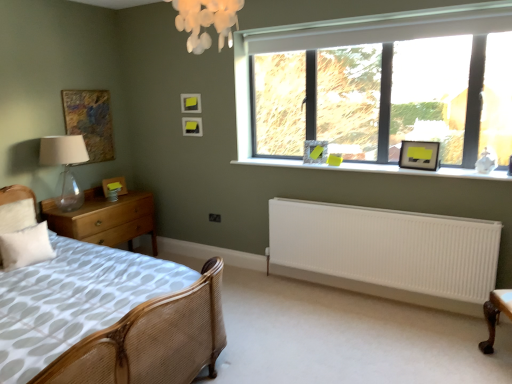
Question: Looking at the image, does white soft pillow at lower left seem bigger or smaller compared to white smooth window sill at center?

Choices:
 (A) small
 (B) big

Answer: (A)

Question: Is white soft pillow at lower left spatially inside white smooth window sill at center, or outside of it?

Choices:
 (A) inside
 (B) outside

Answer: (B)

Question: Which object is the closest to the matte black picture frame at upper center, the third picture frame positioned from the right?

Choices:
 (A) wooden chest of drawers at left
 (B) transparent glass table lamp at left
 (C) matte black picture frame at upper right, positioned as the first picture frame in right-to-left order
 (D) woven cane bed at lower left
 (E) white ribbed radiator at lower center

Answer: (B)

Question: Which of these objects is positioned closest to the woven cane bed at lower left?

Choices:
 (A) white ribbed radiator at lower center
 (B) matte yellow picture frame at left, positioned as the 5th picture frame in right-to-left order
 (C) matte black picture frame at upper right, positioned as the first picture frame in right-to-left order
 (D) matte black picture frame at upper right, the 5th picture frame when ordered from left to right
 (E) clear glass window at upper right

Answer: (A)